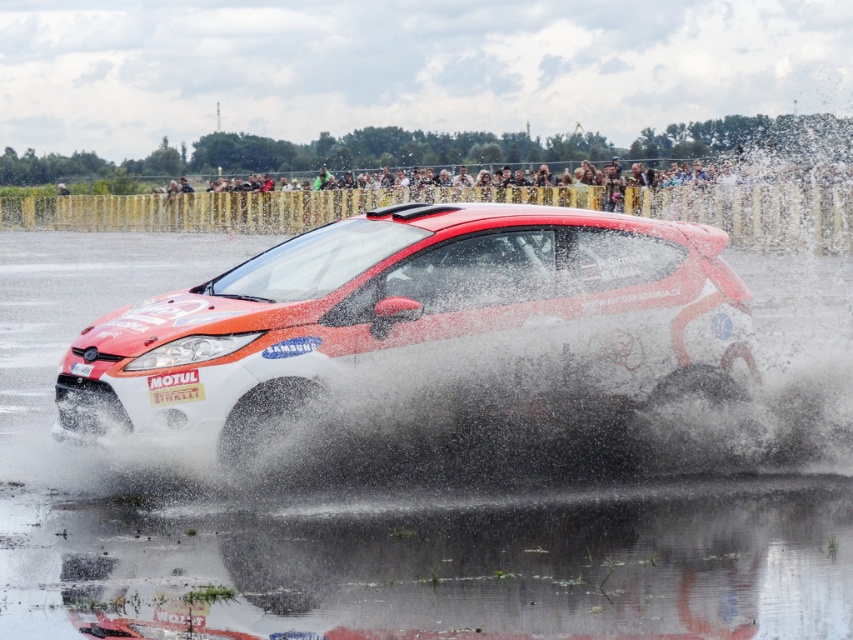
You are a photographer at the rally event. You want to capture a photo where the shiny white car at center is positioned to the right of the black rubber tire at center. Based on the scene, is this possible?

Yes, the shiny white car at center is already positioned to the right of the black rubber tire at center as described in the scene.

Consider the image. You are standing at the edge of the rally course and see the shiny white car at center. If you want to throw a water bottle to the driver, will it reach them? Assume the bottle can travel 10 meters.

The shiny white car at center and viewer are 10.64 meters apart. Since the bottle can only travel 10 meters, it won not reach the driver.

You are a photographer trying to capture the rally car and its tire in the same frame. The camera you are using has a maximum focus range of 20 inches. Based on the scene description, will you be able to focus on both the shiny white car at center and the black rubber tire at center simultaneously?

The shiny white car at center is 23.16 inches away from the black rubber tire at center. Since the distance between them exceeds the camera maximum focus range of 20 inches, you cannot focus on both the shiny white car at center and the black rubber tire at center simultaneously.